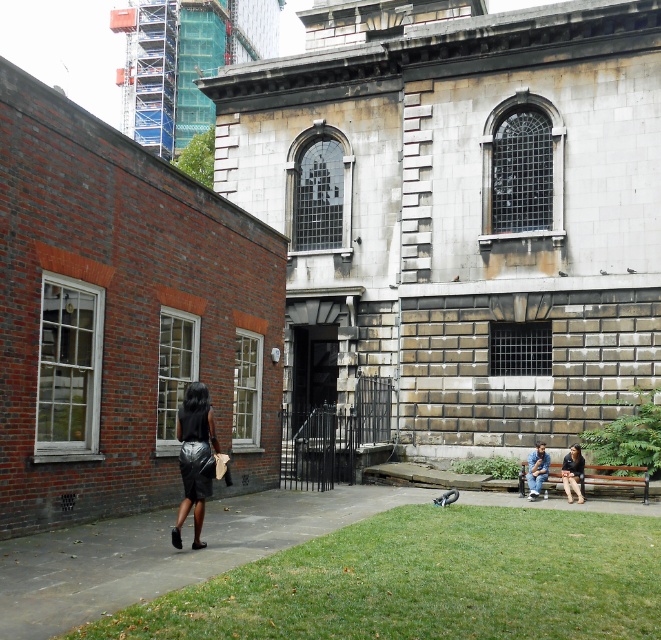
Can you confirm if wooden bench at lower right is wider than blue denim jeans at lower right?

Indeed, wooden bench at lower right has a greater width compared to blue denim jeans at lower right.

Is wooden bench at lower right bigger than blue denim jeans at lower right?

Correct, wooden bench at lower right is larger in size than blue denim jeans at lower right.

Is point (520, 480) more distant than point (529, 472)?

Yes, it is.

At what (x,y) coordinates should I click in order to perform the action: click on wooden bench at lower right. Please return your answer as a coordinate pair (x, y). The width and height of the screenshot is (661, 640). Looking at the image, I should click on (613, 477).

Is the position of shiny black skirt at left less distant than that of gray feathered pigeon at lower center?

Yes, it is in front of gray feathered pigeon at lower center.

Identify the location of shiny black skirt at left. This screenshot has width=661, height=640. (194, 456).

Which is above, shiny black dress at left or black leather jacket at lower right?

Positioned higher is shiny black dress at left.

Does point (198, 420) come in front of point (563, 477)?

Yes.

The height and width of the screenshot is (640, 661). Find the location of `shiny black dress at left`. shiny black dress at left is located at coordinates (194, 452).

You are a GUI agent. You are given a task and a screenshot of the screen. Output one action in this format:
    pyautogui.click(x=<x>, y=<y>)
    Task: Click on the shiny black dress at left
    
    Given the screenshot: What is the action you would take?
    pyautogui.click(x=194, y=452)